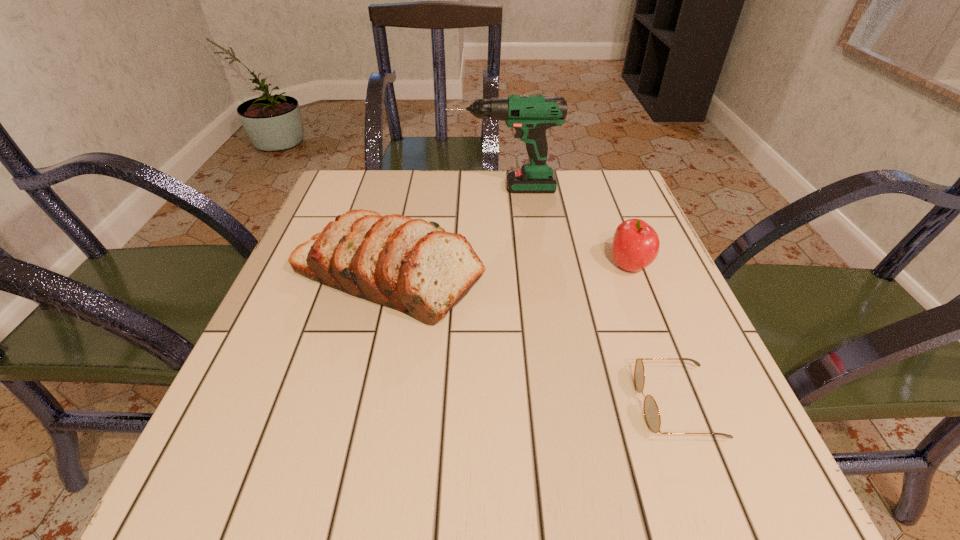
I want to click on free space located on the back of the apple, so click(x=593, y=172).

The width and height of the screenshot is (960, 540). In order to click on vacant point located 0.170m on the lenses of the nearest object in this screenshot , I will do `click(526, 404)`.

Locate an element on the screen. The image size is (960, 540). free region located 0.050m on the lenses of the nearest object is located at coordinates (605, 404).

Locate an element on the screen. The image size is (960, 540). vacant space situated on the lenses of the nearest object is located at coordinates (572, 404).

In order to click on object that is at the far edge in this screenshot , I will do `click(530, 115)`.

You are a GUI agent. You are given a task and a screenshot of the screen. Output one action in this format:
    pyautogui.click(x=<x>, y=<y>)
    Task: Click on the object that is at the left edge
    The height and width of the screenshot is (540, 960).
    Given the screenshot: What is the action you would take?
    pyautogui.click(x=410, y=265)

At what (x,y) coordinates should I click in order to perform the action: click on apple present at the right edge. Please return your answer as a coordinate pair (x, y). The height and width of the screenshot is (540, 960). Looking at the image, I should click on (636, 244).

Where is `sunglasses that is at the right edge`? sunglasses that is at the right edge is located at coordinates (652, 417).

Find the location of a particular element. vacant space at the far edge of the desktop is located at coordinates (420, 204).

Identify the location of free space at the near edge of the desktop. (339, 474).